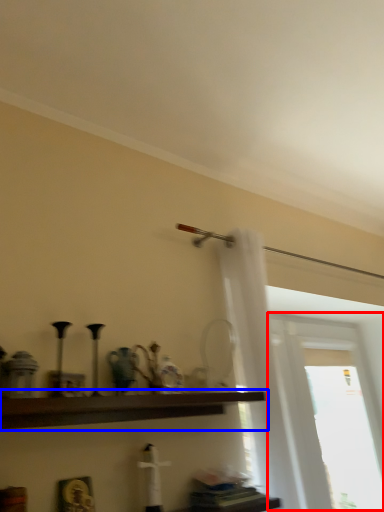
Question: Among these objects, which one is nearest to the camera, window (highlighted by a red box) or shelf (highlighted by a blue box)?

Choices:
 (A) window
 (B) shelf

Answer: (B)